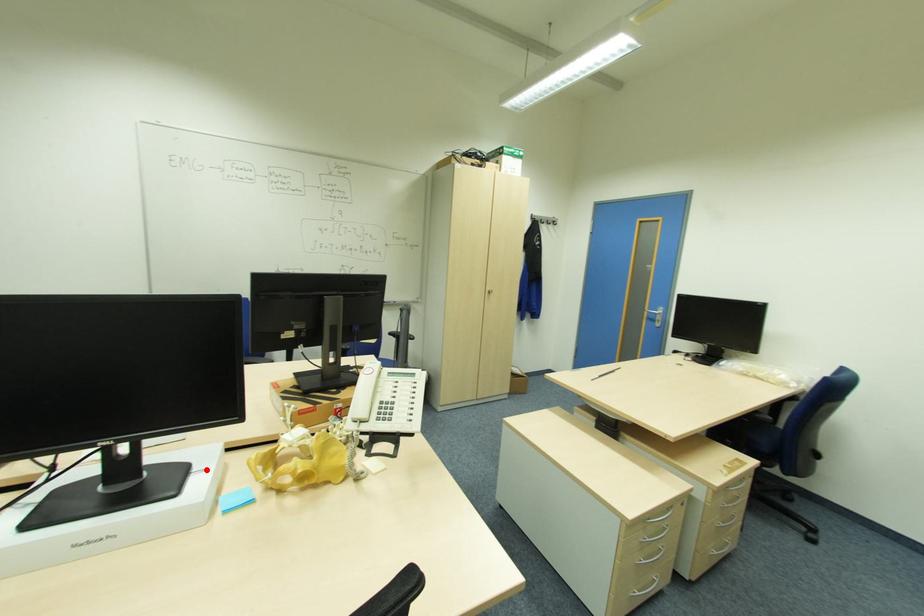
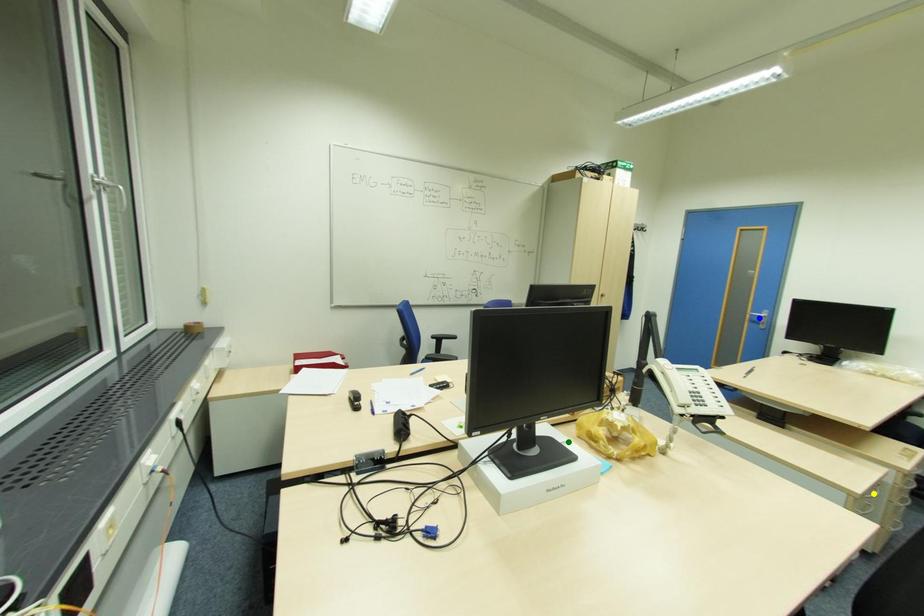
Question: I am providing you with two images of the same scene from different viewpoints. A red point is marked on the first image. You are given multiple points on the second image. Which point in image 2 represents the same 3d spot as the red point in image 1?

Choices:
 (A) green point
 (B) blue point
 (C) yellow point

Answer: (A)